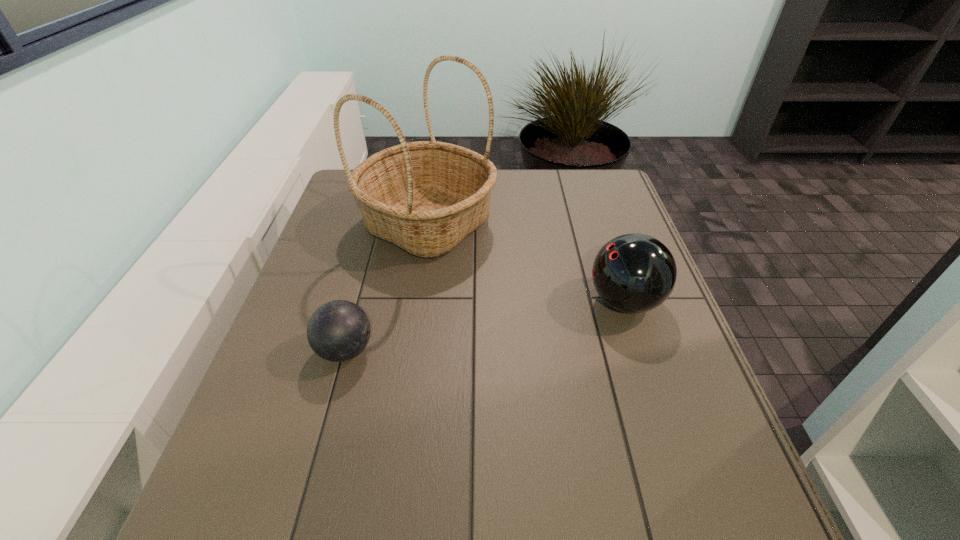
Identify the location of the farthest object. This screenshot has height=540, width=960. (425, 197).

This screenshot has width=960, height=540. What are the coordinates of `basket` in the screenshot? It's located at (425, 197).

Find the location of a particular element. Image resolution: width=960 pixels, height=540 pixels. the right bowling ball is located at coordinates (634, 273).

The width and height of the screenshot is (960, 540). I want to click on the rightmost object, so click(x=634, y=273).

The height and width of the screenshot is (540, 960). In order to click on the shorter bowling ball in this screenshot , I will do `click(339, 330)`.

Identify the location of the shortest object. click(339, 330).

Where is `vacant area situated 0.320m on the right of the tallest object`? This screenshot has width=960, height=540. vacant area situated 0.320m on the right of the tallest object is located at coordinates (604, 224).

Identify the location of free space located 0.200m on the surface of the rightmost object near the finger holes. (505, 301).

Find the location of `free spot located 0.170m on the surface of the rightmost object near the finger holes`. free spot located 0.170m on the surface of the rightmost object near the finger holes is located at coordinates (517, 301).

This screenshot has width=960, height=540. Identify the location of vacant area situated 0.330m on the surface of the rightmost object near the finger holes. (452, 301).